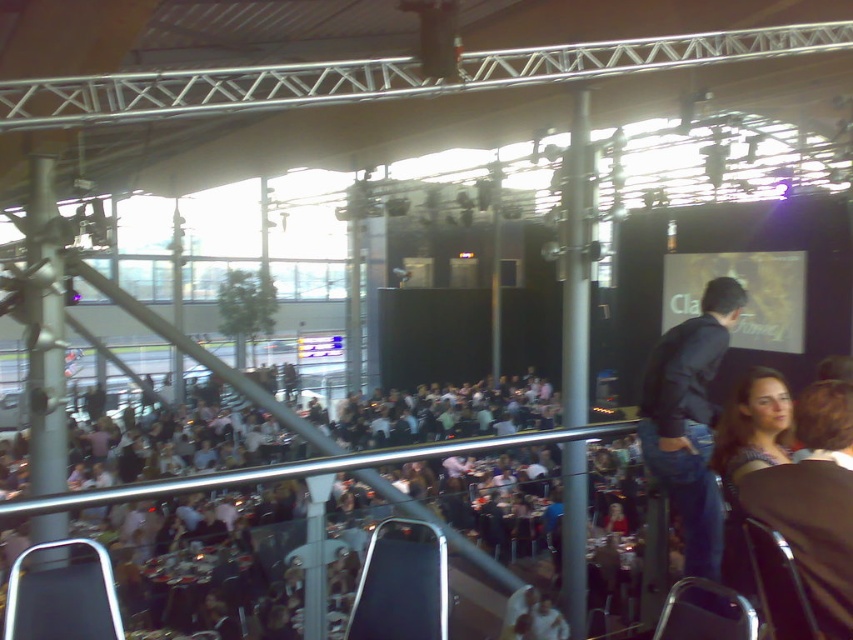
Is dark blue jeans at center shorter than blue denim shirt at lower right?

Incorrect, dark blue jeans at center's height does not fall short of blue denim shirt at lower right's.

Identify the location of dark blue jeans at center. (689, 420).

In order to click on dark blue jeans at center in this screenshot , I will do `click(689, 420)`.

At what (x,y) coordinates should I click in order to perform the action: click on dark blue jeans at center. Please return your answer as a coordinate pair (x, y). The height and width of the screenshot is (640, 853). Looking at the image, I should click on (689, 420).

Who is lower down, white fabric crowd at center or dark blue jeans at center?

white fabric crowd at center is below.

Is point (465, 490) in front of point (675, 422)?

No, (465, 490) is behind (675, 422).

Find the location of a particular element. white fabric crowd at center is located at coordinates (207, 544).

How distant is white fabric crowd at center from blue denim shirt at lower right?

The distance of white fabric crowd at center from blue denim shirt at lower right is 8.03 meters.

Who is positioned more to the left, white fabric crowd at center or blue denim shirt at lower right?

From the viewer's perspective, white fabric crowd at center appears more on the left side.

Is point (395, 429) positioned behind point (756, 429)?

Yes, point (395, 429) is farther from viewer.

Find the location of a particular element. The width and height of the screenshot is (853, 640). white fabric crowd at center is located at coordinates (207, 544).